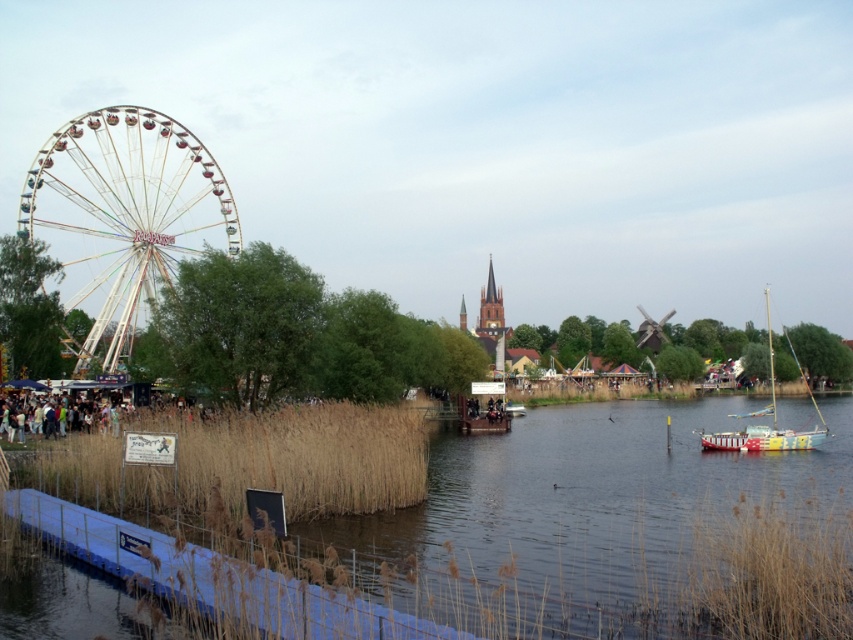
Question: Does multicolored metallic ferris wheel at left appear over painted wood sailboat at right?

Choices:
 (A) yes
 (B) no

Answer: (A)

Question: Does multicolored metallic ferris wheel at left appear over painted wood sailboat at right?

Choices:
 (A) yes
 (B) no

Answer: (A)

Question: Which object is farther from the camera taking this photo?

Choices:
 (A) multicolored metallic ferris wheel at left
 (B) painted wood sailboat at right

Answer: (B)

Question: From the image, what is the correct spatial relationship of multicolored metallic ferris wheel at left in relation to painted wood sailboat at right?

Choices:
 (A) below
 (B) above

Answer: (B)